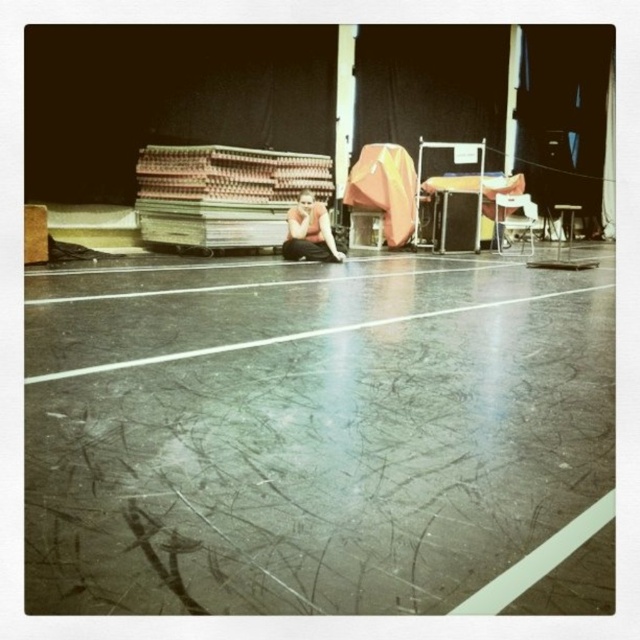
Question: Estimate the real-world distances between objects in this image. Which object is farther from the wooden planks at center?

Choices:
 (A) metallic silver chair at center-right
 (B) matte black squat at center

Answer: (A)

Question: Does wooden planks at center come in front of metallic silver chair at center-right?

Choices:
 (A) yes
 (B) no

Answer: (A)

Question: Which of the following is the closest to the observer?

Choices:
 (A) matte black squat at center
 (B) metallic silver chair at center-right
 (C) wooden planks at center

Answer: (A)

Question: Can you confirm if matte black squat at center is wider than metallic silver chair at center-right?

Choices:
 (A) yes
 (B) no

Answer: (B)

Question: Observing the image, what is the correct spatial positioning of wooden planks at center in reference to metallic silver chair at center-right?

Choices:
 (A) right
 (B) left

Answer: (B)

Question: Which is nearer to the wooden planks at center?

Choices:
 (A) matte black squat at center
 (B) metallic silver chair at center-right

Answer: (A)